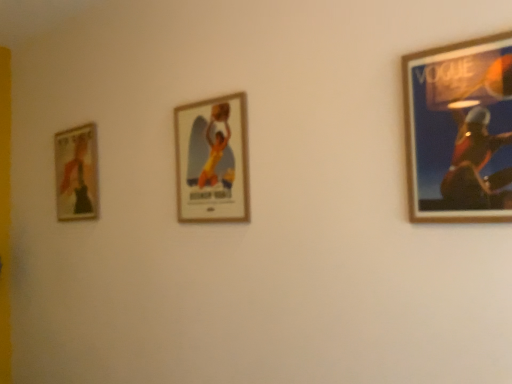
What is the approximate width of wooden frame at right, which is the 3th picture frame from back to front?

wooden frame at right, which is the 3th picture frame from back to front, is 1.16 inches in width.

Where is `wooden framed poster at center, the second picture frame positioned from the back`? The image size is (512, 384). wooden framed poster at center, the second picture frame positioned from the back is located at coordinates (212, 160).

Identify the location of wooden frame at right, which is the 1th picture frame in right-to-left order. The width and height of the screenshot is (512, 384). (460, 131).

From the picture: Considering the sizes of objects matte gold picture frame at left, placed as the 3th picture frame when sorted from right to left, and wooden frame at right, the 1th picture frame when ordered from front to back, in the image provided, who is shorter, matte gold picture frame at left, placed as the 3th picture frame when sorted from right to left, or wooden frame at right, the 1th picture frame when ordered from front to back,?

Standing shorter between the two is wooden frame at right, the 1th picture frame when ordered from front to back.

From the image's perspective, is matte gold picture frame at left, which ranks as the first picture frame in left-to-right order, positioned above or below wooden frame at right, which is the 1th picture frame in right-to-left order?

From the image's perspective, matte gold picture frame at left, which ranks as the first picture frame in left-to-right order, appears below wooden frame at right, which is the 1th picture frame in right-to-left order.

Considering the relative sizes of matte gold picture frame at left, placed as the 3th picture frame when sorted from right to left, and wooden frame at right, the 1th picture frame when ordered from front to back, in the image provided, is matte gold picture frame at left, placed as the 3th picture frame when sorted from right to left, thinner than wooden frame at right, the 1th picture frame when ordered from front to back,?

No.

Considering the relative sizes of matte gold picture frame at left, marked as the 1th picture frame in a back-to-front arrangement, and wooden frame at right, acting as the 3th picture frame starting from the left, in the image provided, is matte gold picture frame at left, marked as the 1th picture frame in a back-to-front arrangement, bigger than wooden frame at right, acting as the 3th picture frame starting from the left,?

Yes, matte gold picture frame at left, marked as the 1th picture frame in a back-to-front arrangement, is bigger than wooden frame at right, acting as the 3th picture frame starting from the left.

Is matte gold picture frame at left, marked as the 1th picture frame in a back-to-front arrangement, next to wooden framed poster at center, the 2th picture frame in the left-to-right sequence?

There is a gap between matte gold picture frame at left, marked as the 1th picture frame in a back-to-front arrangement, and wooden framed poster at center, the 2th picture frame in the left-to-right sequence.

From the image's perspective, is matte gold picture frame at left, the third picture frame from the front, above wooden framed poster at center, which ranks as the 2th picture frame in right-to-left order?

Incorrect, from the image's perspective, matte gold picture frame at left, the third picture frame from the front, is lower than wooden framed poster at center, which ranks as the 2th picture frame in right-to-left order.

Between matte gold picture frame at left, the third picture frame from the front, and wooden framed poster at center, which ranks as the 2th picture frame in right-to-left order, which one has larger size?

matte gold picture frame at left, the third picture frame from the front.

Who is taller, matte gold picture frame at left, marked as the 1th picture frame in a back-to-front arrangement, or wooden framed poster at center, acting as the second picture frame starting from the front?

matte gold picture frame at left, marked as the 1th picture frame in a back-to-front arrangement.

From the image's perspective, who appears lower, wooden frame at right, which is the 3th picture frame from back to front, or matte gold picture frame at left, placed as the 3th picture frame when sorted from right to left?

From the image's view, matte gold picture frame at left, placed as the 3th picture frame when sorted from right to left, is below.

Is wooden frame at right, acting as the 3th picture frame starting from the left, further to the viewer compared to matte gold picture frame at left, the third picture frame from the front?

No, wooden frame at right, acting as the 3th picture frame starting from the left, is in front of matte gold picture frame at left, the third picture frame from the front.

Which of these two, wooden frame at right, which is the 3th picture frame from back to front, or matte gold picture frame at left, the third picture frame from the front, is bigger?

With larger size is matte gold picture frame at left, the third picture frame from the front.

Considering the points (472, 162) and (85, 204), which point is in front, point (472, 162) or point (85, 204)?

The point (472, 162) is more forward.

Choose the correct answer: Is wooden framed poster at center, which ranks as the 2th picture frame in right-to-left order, inside wooden frame at right, acting as the 3th picture frame starting from the left, or outside it?

wooden framed poster at center, which ranks as the 2th picture frame in right-to-left order, is not enclosed by wooden frame at right, acting as the 3th picture frame starting from the left.

Which object is positioned more to the left, wooden framed poster at center, which ranks as the 2th picture frame in right-to-left order, or wooden frame at right, which is the 1th picture frame in right-to-left order?

wooden framed poster at center, which ranks as the 2th picture frame in right-to-left order, is more to the left.

Locate an element on the screen. picture frame that is the 1st one when counting leftward from the wooden frame at right, which is the 1th picture frame in right-to-left order is located at coordinates (212, 160).

Who is bigger, wooden framed poster at center, acting as the second picture frame starting from the front, or wooden frame at right, which is the 1th picture frame in right-to-left order?

With larger size is wooden framed poster at center, acting as the second picture frame starting from the front.

In the scene shown: Is wooden frame at right, which is the 3th picture frame from back to front, facing away from wooden framed poster at center, the 2th picture frame in the left-to-right sequence?

No.

Does point (435, 198) come behind point (187, 135)?

No, it is in front of (187, 135).

Which object is wider, wooden frame at right, acting as the 3th picture frame starting from the left, or wooden framed poster at center, the 2th picture frame in the left-to-right sequence?

wooden framed poster at center, the 2th picture frame in the left-to-right sequence.

Which is in front, wooden frame at right, which is the 1th picture frame in right-to-left order, or wooden framed poster at center, the second picture frame positioned from the back?

Positioned in front is wooden frame at right, which is the 1th picture frame in right-to-left order.

Looking at this image, considering the sizes of objects wooden framed poster at center, which ranks as the 2th picture frame in right-to-left order, and matte gold picture frame at left, placed as the 3th picture frame when sorted from right to left, in the image provided, who is wider, wooden framed poster at center, which ranks as the 2th picture frame in right-to-left order, or matte gold picture frame at left, placed as the 3th picture frame when sorted from right to left,?

matte gold picture frame at left, placed as the 3th picture frame when sorted from right to left.

Is wooden framed poster at center, acting as the second picture frame starting from the front, positioned in front of matte gold picture frame at left, placed as the 3th picture frame when sorted from right to left?

Yes, it is.

How many degrees apart are the facing directions of wooden framed poster at center, which ranks as the 2th picture frame in right-to-left order, and matte gold picture frame at left, the third picture frame from the front?

The angle between the facing direction of wooden framed poster at center, which ranks as the 2th picture frame in right-to-left order, and the facing direction of matte gold picture frame at left, the third picture frame from the front, is 1.72 degrees.

Find the location of a particular element. This screenshot has width=512, height=384. picture frame located below the wooden framed poster at center, acting as the second picture frame starting from the front (from the image's perspective) is located at coordinates (76, 173).

At what (x,y) coordinates should I click in order to perform the action: click on picture frame that is the 2nd one when counting leftward from the wooden frame at right, the 1th picture frame when ordered from front to back. Please return your answer as a coordinate pair (x, y). This screenshot has width=512, height=384. Looking at the image, I should click on (76, 173).

You are a GUI agent. You are given a task and a screenshot of the screen. Output one action in this format:
    pyautogui.click(x=<x>, y=<y>)
    Task: Click on the picture frame that is above the wooden framed poster at center, the second picture frame positioned from the back (from a real-world perspective)
    This screenshot has width=512, height=384.
    Given the screenshot: What is the action you would take?
    pyautogui.click(x=76, y=173)

Which object lies nearer to the anchor point wooden framed poster at center, the second picture frame positioned from the back, matte gold picture frame at left, marked as the 1th picture frame in a back-to-front arrangement, or wooden frame at right, acting as the 3th picture frame starting from the left?

Based on the image, wooden frame at right, acting as the 3th picture frame starting from the left, appears to be nearer to wooden framed poster at center, the second picture frame positioned from the back.

From the image, which object appears to be nearer to wooden frame at right, which is the 1th picture frame in right-to-left order, wooden framed poster at center, which ranks as the 2th picture frame in right-to-left order, or matte gold picture frame at left, placed as the 3th picture frame when sorted from right to left?

wooden framed poster at center, which ranks as the 2th picture frame in right-to-left order, is closer to wooden frame at right, which is the 1th picture frame in right-to-left order.

Based on their spatial positions, is wooden frame at right, which is the 3th picture frame from back to front, or matte gold picture frame at left, marked as the 1th picture frame in a back-to-front arrangement, further from wooden framed poster at center, acting as the second picture frame starting from the front?

matte gold picture frame at left, marked as the 1th picture frame in a back-to-front arrangement, is positioned further to the anchor wooden framed poster at center, acting as the second picture frame starting from the front.

When comparing their distances from wooden frame at right, the 1th picture frame when ordered from front to back, does matte gold picture frame at left, marked as the 1th picture frame in a back-to-front arrangement, or wooden framed poster at center, acting as the second picture frame starting from the front, seem closer?

wooden framed poster at center, acting as the second picture frame starting from the front.

Looking at the image, which one is located closer to matte gold picture frame at left, which ranks as the first picture frame in left-to-right order, wooden framed poster at center, the 2th picture frame in the left-to-right sequence, or wooden frame at right, which is the 3th picture frame from back to front?

wooden framed poster at center, the 2th picture frame in the left-to-right sequence, lies closer to matte gold picture frame at left, which ranks as the first picture frame in left-to-right order, than the other object.

When comparing their distances from matte gold picture frame at left, which ranks as the first picture frame in left-to-right order, does wooden frame at right, which is the 1th picture frame in right-to-left order, or wooden framed poster at center, the second picture frame positioned from the back, seem further?

wooden frame at right, which is the 1th picture frame in right-to-left order, is positioned further to the anchor matte gold picture frame at left, which ranks as the first picture frame in left-to-right order.

Image resolution: width=512 pixels, height=384 pixels. I want to click on picture frame between matte gold picture frame at left, marked as the 1th picture frame in a back-to-front arrangement, and wooden frame at right, which is the 1th picture frame in right-to-left order, in the horizontal direction, so click(x=212, y=160).